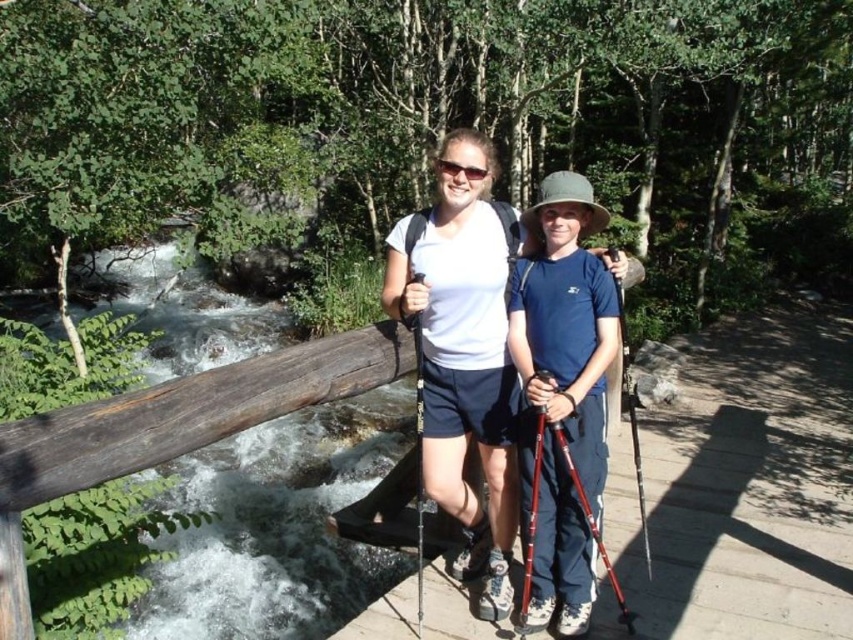
Question: Can you confirm if white matte shirt at center is thinner than matte blue shirt at center?

Choices:
 (A) no
 (B) yes

Answer: (A)

Question: Does white matte shirt at center have a smaller size compared to matte blue shirt at center?

Choices:
 (A) yes
 (B) no

Answer: (B)

Question: Which object is farther from the camera taking this photo?

Choices:
 (A) matte blue shirt at center
 (B) white matte shirt at center

Answer: (B)

Question: Can you confirm if white matte shirt at center is positioned to the left of matte blue shirt at center?

Choices:
 (A) yes
 (B) no

Answer: (A)

Question: Which point is farther to the camera?

Choices:
 (A) (503, 512)
 (B) (517, 333)

Answer: (A)

Question: Which point is closer to the camera taking this photo?

Choices:
 (A) (479, 291)
 (B) (587, 180)

Answer: (A)